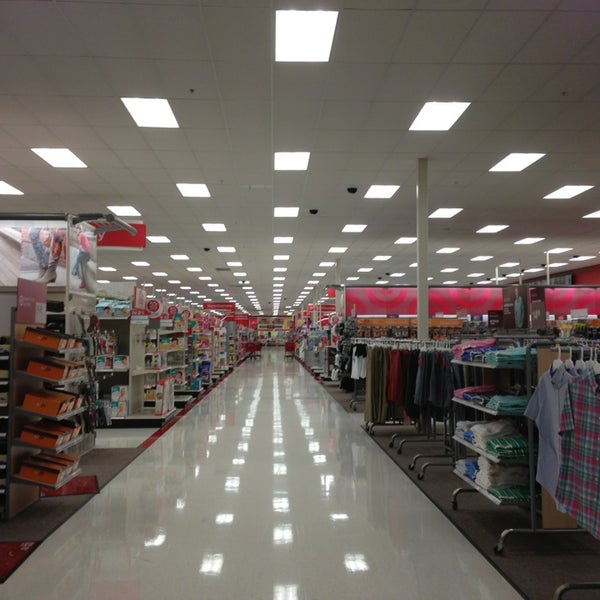
The height and width of the screenshot is (600, 600). Find the location of `floded clothes sitting on shelf`. floded clothes sitting on shelf is located at coordinates click(491, 403), click(483, 434).